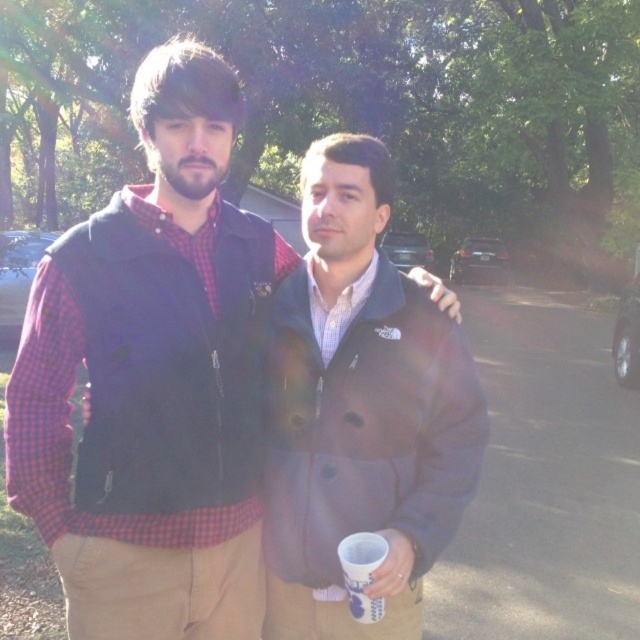
Question: Observing the image, what is the correct spatial positioning of brown woolen jacket at center in reference to white paper cup at lower center?

Choices:
 (A) left
 (B) right

Answer: (B)

Question: Which object appears closest to the camera in this image?

Choices:
 (A) brushed metal vest at upper left
 (B) white paper cup at lower center
 (C) brown woolen jacket at center

Answer: (B)

Question: Is brushed metal vest at upper left above brown woolen jacket at center?

Choices:
 (A) no
 (B) yes

Answer: (B)

Question: Can you confirm if brushed metal vest at upper left is positioned above brown woolen jacket at center?

Choices:
 (A) yes
 (B) no

Answer: (A)

Question: Which point is farther from the camera taking this photo?

Choices:
 (A) (364, 600)
 (B) (316, 417)
 (C) (65, 275)

Answer: (B)

Question: Which object is the closest to the brushed metal vest at upper left?

Choices:
 (A) brown woolen jacket at center
 (B) white paper cup at lower center

Answer: (A)